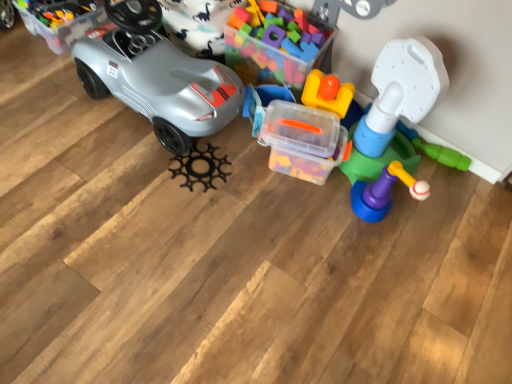
Question: Should I look upward or downward to see translucent plastic blocks at center, acting as the third toy starting from the left?

Choices:
 (A) down
 (B) up

Answer: (B)

Question: Does translucent plastic container at center, the third toy viewed from the right, have a lesser width compared to matte gray car at left?

Choices:
 (A) yes
 (B) no

Answer: (A)

Question: From a real-world perspective, is translucent plastic container at center, the second toy in the left-to-right sequence, located beneath matte gray car at left?

Choices:
 (A) no
 (B) yes

Answer: (B)

Question: Considering the relative positions of translucent plastic container at center, the second toy in the left-to-right sequence, and matte gray car at left in the image provided, is translucent plastic container at center, the second toy in the left-to-right sequence, to the left of matte gray car at left from the viewer's perspective?

Choices:
 (A) yes
 (B) no

Answer: (B)

Question: Is translucent plastic container at center, the third toy viewed from the right, facing away from matte gray car at left?

Choices:
 (A) yes
 (B) no

Answer: (B)

Question: Can you see translucent plastic container at center, the second toy in the left-to-right sequence, touching matte gray car at left?

Choices:
 (A) yes
 (B) no

Answer: (B)

Question: Is matte gray car at left completely or partially inside translucent plastic container at center, the third toy viewed from the right?

Choices:
 (A) yes
 (B) no

Answer: (B)

Question: Does translucent plastic blocks at center, acting as the third toy starting from the left, have a lesser height compared to black matte gear at center, positioned as the fourth toy in right-to-left order?

Choices:
 (A) yes
 (B) no

Answer: (B)

Question: Is translucent plastic blocks at center, which is counted as the 2th toy, starting from the right, not close to black matte gear at center, positioned as the fourth toy in right-to-left order?

Choices:
 (A) no
 (B) yes

Answer: (A)

Question: Does translucent plastic blocks at center, acting as the third toy starting from the left, contain black matte gear at center, positioned as the fourth toy in right-to-left order?

Choices:
 (A) no
 (B) yes

Answer: (A)

Question: Is the surface of translucent plastic blocks at center, which is counted as the 2th toy, starting from the right, in direct contact with black matte gear at center, which is counted as the first toy, starting from the left?

Choices:
 (A) yes
 (B) no

Answer: (B)

Question: Is translucent plastic blocks at center, acting as the third toy starting from the left, bigger than black matte gear at center, which is counted as the first toy, starting from the left?

Choices:
 (A) yes
 (B) no

Answer: (A)

Question: Is translucent plastic blocks at center, which is counted as the 2th toy, starting from the right, behind black matte gear at center, positioned as the fourth toy in right-to-left order?

Choices:
 (A) yes
 (B) no

Answer: (B)

Question: Does translucent plastic tower at right, the first toy from the right, contain black matte gear at center, which is counted as the first toy, starting from the left?

Choices:
 (A) no
 (B) yes

Answer: (A)